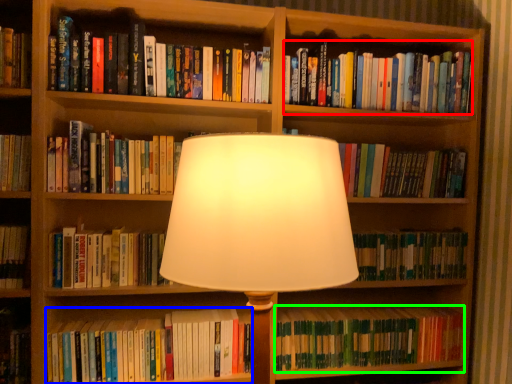
Question: Which object is the farthest from book (highlighted by a red box)? Choose among these: book (highlighted by a blue box) or book (highlighted by a green box).

Choices:
 (A) book
 (B) book

Answer: (A)